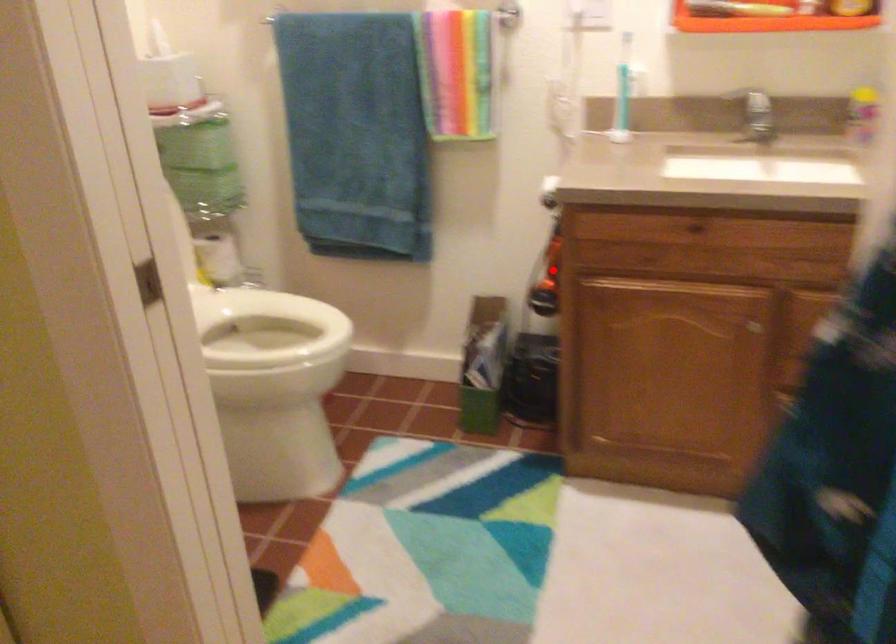
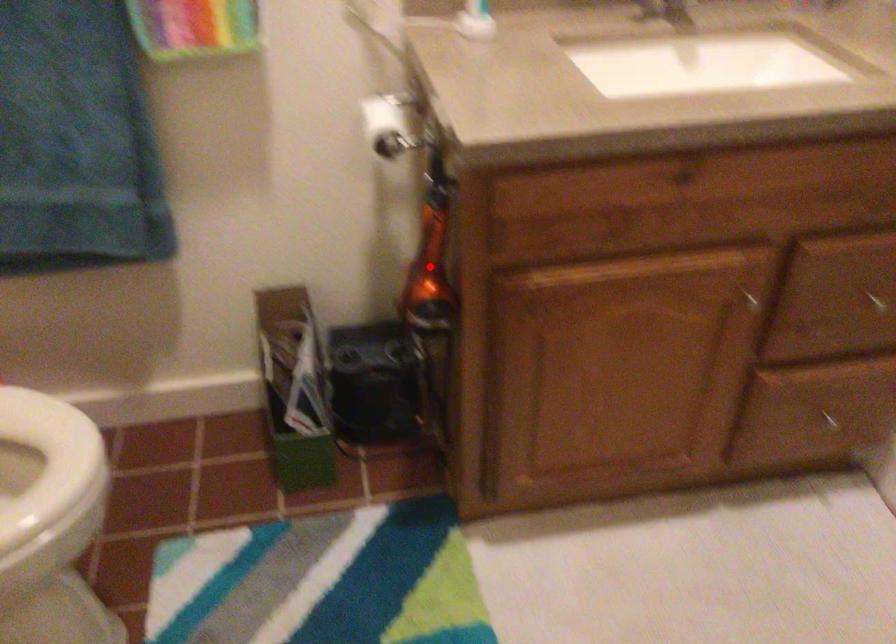
I am providing you with two images of the same scene from different viewpoints. A red point is marked on the first image and another point is marked on the second image. Is the red point in image1 aligned with the point shown in image2?

Yes